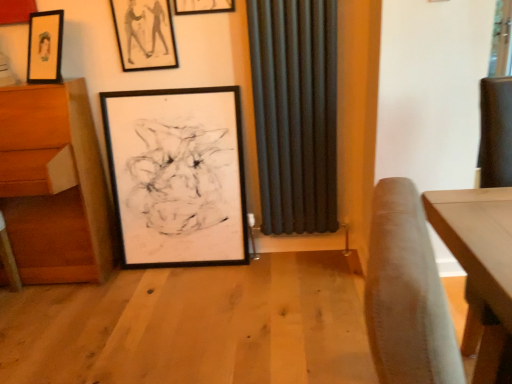
Question: From a real-world perspective, is wooden drawer at left physically located above or below matte black picture frame at upper center, which is counted as the 3th picture frame, starting from the bottom?

Choices:
 (A) below
 (B) above

Answer: (A)

Question: Visually, is wooden drawer at left positioned to the left or to the right of matte black picture frame at upper center, which is counted as the 3th picture frame, starting from the bottom?

Choices:
 (A) left
 (B) right

Answer: (A)

Question: Which object is the closest to the dark matte radiator at center?

Choices:
 (A) black matte picture frame at center, the 1th picture frame positioned from the bottom
 (B) wooden drawer at left
 (C) matte black picture frame at upper center, which ranks as the second picture frame in top-to-bottom order
 (D) matte black picture frame at upper center, which is counted as the 3th picture frame, starting from the bottom

Answer: (A)

Question: Considering the real-world distances, which object is farthest from the black matte picture frame at center, acting as the third picture frame starting from the top?

Choices:
 (A) wooden drawer at left
 (B) matte black picture frame at upper center, which appears as the first picture frame when viewed from the top
 (C) dark matte radiator at center
 (D) matte black picture frame at upper center, which ranks as the second picture frame in top-to-bottom order

Answer: (B)